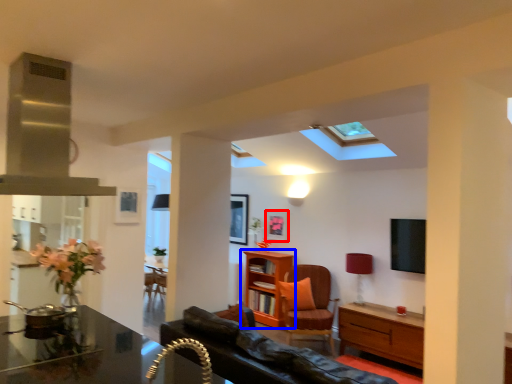
Question: Which point is closer to the camera, picture frame (highlighted by a red box) or shelf (highlighted by a blue box)?

Choices:
 (A) picture frame
 (B) shelf

Answer: (B)